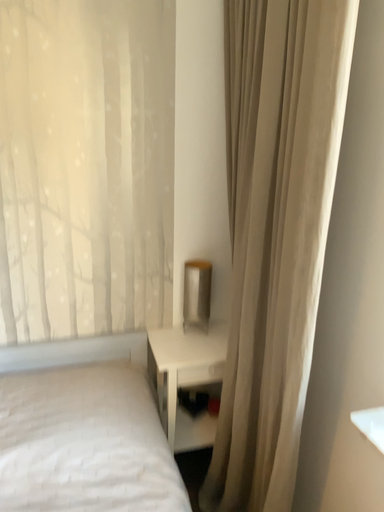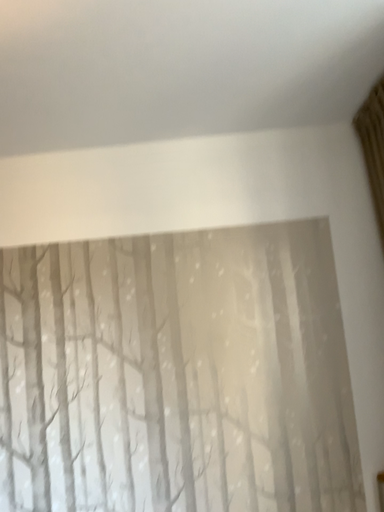
Question: How did the camera likely rotate when shooting the video?

Choices:
 (A) rotated downward
 (B) rotated upward

Answer: (B)